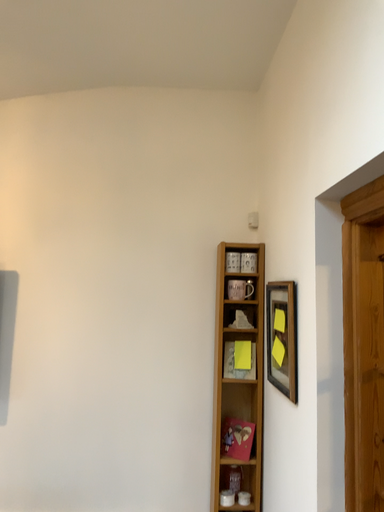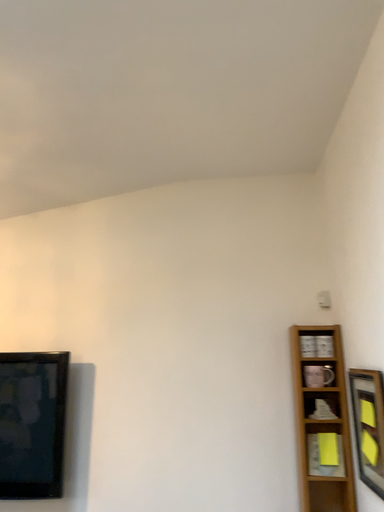
Question: Which way did the camera rotate in the video?

Choices:
 (A) rotated left
 (B) rotated right

Answer: (A)